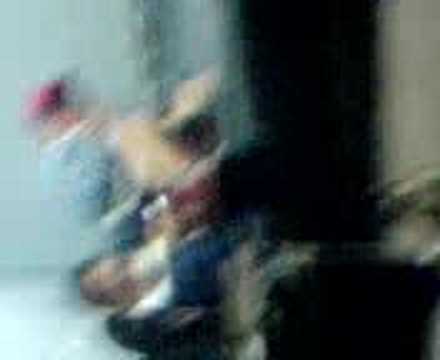
At what (x,y) coordinates should I click in order to perform the action: click on vertical bar area. Please return your answer as a coordinate pair (x, y). This screenshot has height=360, width=440. Looking at the image, I should click on click(278, 41), click(339, 156).